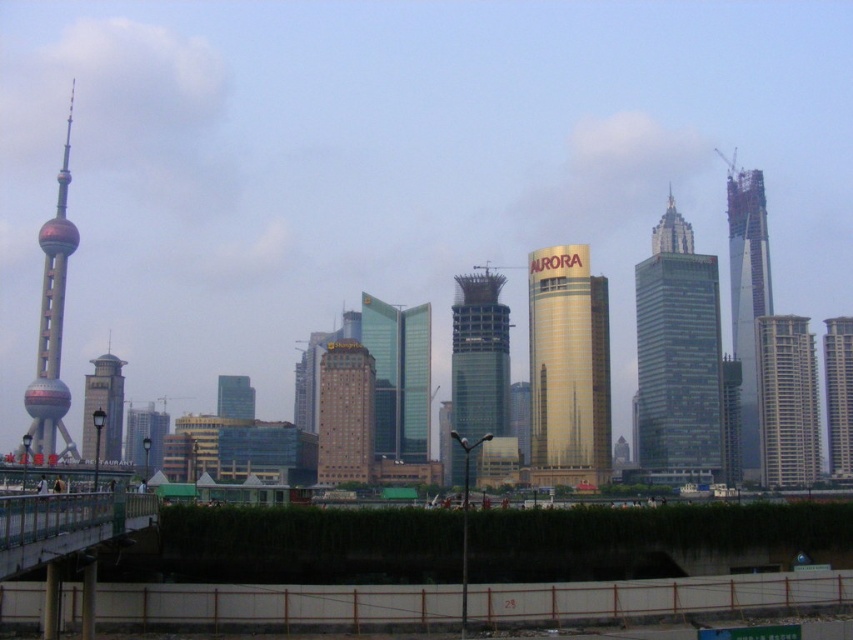
Question: Observing the image, what is the correct spatial positioning of beige glass building at right in reference to glassy reflective skyscraper at center?

Choices:
 (A) right
 (B) left

Answer: (A)

Question: Which point is closer to the camera taking this photo?

Choices:
 (A) (763, 355)
 (B) (347, 413)
 (C) (827, 353)

Answer: (B)

Question: Can you confirm if gold reflective tower at center is positioned to the left of glassy skyscraper at center?

Choices:
 (A) yes
 (B) no

Answer: (B)

Question: Which of the following is the closest to the observer?

Choices:
 (A) (680, 369)
 (B) (770, 372)

Answer: (A)

Question: Which of these objects is positioned farthest from the matte gold tower at center-left?

Choices:
 (A) glassy skyscraper at center
 (B) gold glass skyscraper at right
 (C) shiny silver tower at left

Answer: (B)

Question: Is brown brick building at center positioned behind matte gold tower at center-left?

Choices:
 (A) yes
 (B) no

Answer: (A)